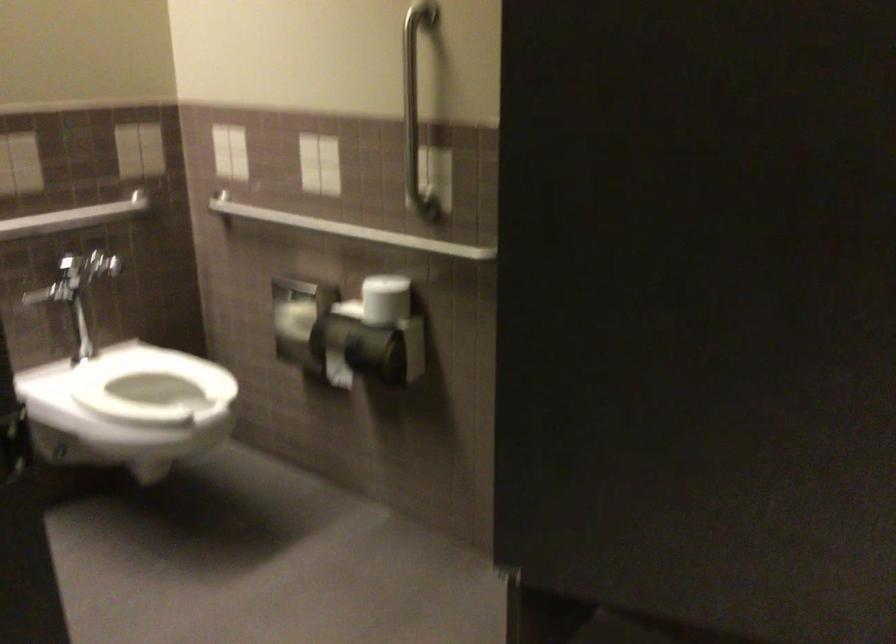
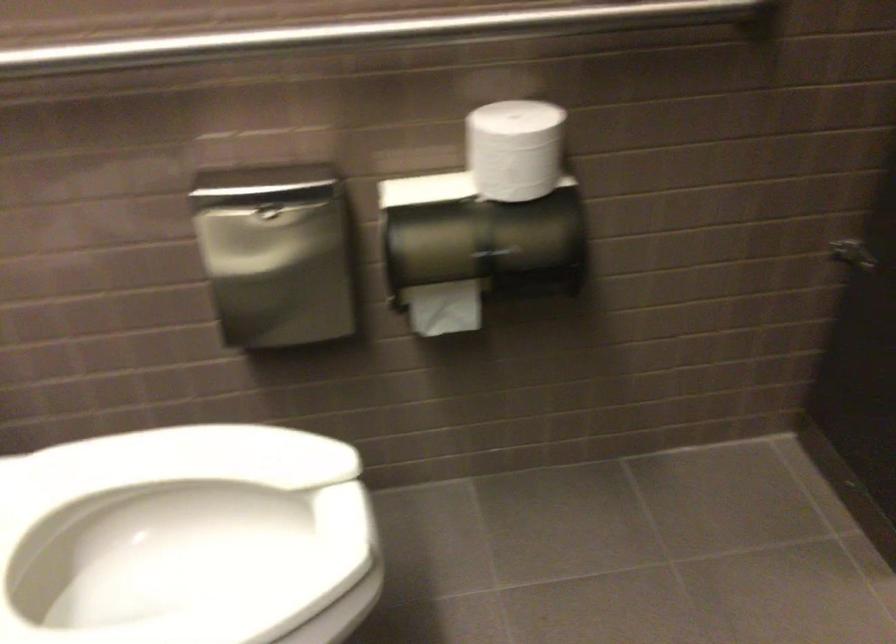
The point at (x=334, y=222) is marked in the first image. Where is the corresponding point in the second image?

(368, 33)